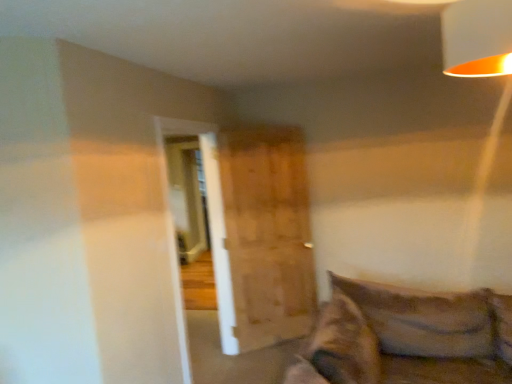
Describe the element at coordinates (477, 38) in the screenshot. The image size is (512, 384). I see `orange matte lampshade at upper right` at that location.

What are the coordinates of `orange matte lampshade at upper right` in the screenshot? It's located at (477, 38).

You are a GUI agent. You are given a task and a screenshot of the screen. Output one action in this format:
    pyautogui.click(x=<x>, y=<y>)
    Task: Click on the wooden barn door at center
    
    Given the screenshot: What is the action you would take?
    pyautogui.click(x=266, y=236)

The height and width of the screenshot is (384, 512). What do you see at coordinates (266, 236) in the screenshot? I see `wooden barn door at center` at bounding box center [266, 236].

Identify the location of orange matte lampshade at upper right. This screenshot has width=512, height=384. (477, 38).

Considering the relative positions of wooden barn door at center and orange matte lampshade at upper right in the image provided, is wooden barn door at center to the left of orange matte lampshade at upper right from the viewer's perspective?

Indeed, wooden barn door at center is positioned on the left side of orange matte lampshade at upper right.

In the image, is wooden barn door at center positioned in front of or behind orange matte lampshade at upper right?

wooden barn door at center is positioned farther from the viewer than orange matte lampshade at upper right.

Which is farther, (284, 128) or (472, 2)?

The point (284, 128) is behind.

From the image's perspective, which one is positioned higher, wooden barn door at center or orange matte lampshade at upper right?

orange matte lampshade at upper right.

From a real-world perspective, does wooden barn door at center stand above orange matte lampshade at upper right?

No, from a real-world perspective, wooden barn door at center is not over orange matte lampshade at upper right

Does wooden barn door at center have a greater width compared to orange matte lampshade at upper right?

No, wooden barn door at center is not wider than orange matte lampshade at upper right.

Considering the relative sizes of wooden barn door at center and orange matte lampshade at upper right in the image provided, is wooden barn door at center taller than orange matte lampshade at upper right?

Yes.

Considering the relative sizes of wooden barn door at center and orange matte lampshade at upper right in the image provided, is wooden barn door at center smaller than orange matte lampshade at upper right?

No, wooden barn door at center is not smaller than orange matte lampshade at upper right.

Is wooden barn door at center completely or partially outside of orange matte lampshade at upper right?

Yes.

Does wooden barn door at center touch orange matte lampshade at upper right?

wooden barn door at center and orange matte lampshade at upper right are clearly separated.

Is wooden barn door at center turned away from orange matte lampshade at upper right?

No, wooden barn door at center's orientation is not away from orange matte lampshade at upper right.

Looking at this image, how different are the orientations of wooden barn door at center and orange matte lampshade at upper right in degrees?

wooden barn door at center and orange matte lampshade at upper right are facing 57.4 degrees away from each other.

Measure the distance between wooden barn door at center and orange matte lampshade at upper right.

wooden barn door at center is 8.21 feet away from orange matte lampshade at upper right.

Locate an element on the screen. This screenshot has width=512, height=384. barn door below the orange matte lampshade at upper right (from the image's perspective) is located at coordinates (266, 236).

Which is more to the left, orange matte lampshade at upper right or wooden barn door at center?

wooden barn door at center is more to the left.

Who is more distant, orange matte lampshade at upper right or wooden barn door at center?

wooden barn door at center is further from the camera.

Between point (457, 52) and point (286, 208), which one is positioned in front?

Positioned in front is point (457, 52).

From the image's perspective, which is above, orange matte lampshade at upper right or wooden barn door at center?

From the image's view, orange matte lampshade at upper right is above.

From a real-world perspective, which is physically below, orange matte lampshade at upper right or wooden barn door at center?

wooden barn door at center.

Can you confirm if orange matte lampshade at upper right is thinner than wooden barn door at center?

No.

Who is taller, orange matte lampshade at upper right or wooden barn door at center?

Standing taller between the two is wooden barn door at center.

Considering the sizes of orange matte lampshade at upper right and wooden barn door at center in the image, is orange matte lampshade at upper right bigger or smaller than wooden barn door at center?

orange matte lampshade at upper right is smaller than wooden barn door at center.

Can we say orange matte lampshade at upper right lies outside wooden barn door at center?

Yes, orange matte lampshade at upper right is not within wooden barn door at center.

Does orange matte lampshade at upper right touch wooden barn door at center?

No, orange matte lampshade at upper right is not with wooden barn door at center.

Is orange matte lampshade at upper right oriented towards wooden barn door at center?

No, orange matte lampshade at upper right does not turn towards wooden barn door at center.

Identify the location of lamp above the wooden barn door at center (from the image's perspective). (477, 38).

This screenshot has width=512, height=384. In order to click on lamp above the wooden barn door at center (from the image's perspective) in this screenshot , I will do `click(477, 38)`.

Where is `lamp lying in front of the wooden barn door at center`? This screenshot has height=384, width=512. lamp lying in front of the wooden barn door at center is located at coordinates (477, 38).